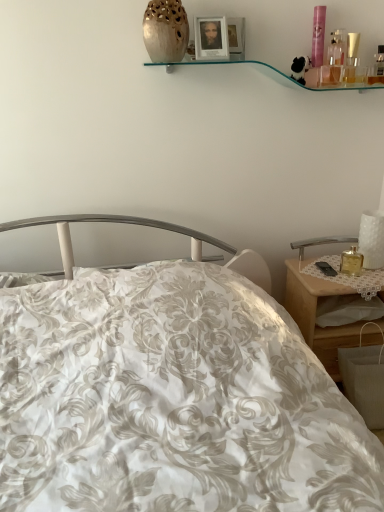
Question: From a real-world perspective, is matte wooden picture frame at upper center above or below wooden nightstand at right?

Choices:
 (A) below
 (B) above

Answer: (B)

Question: In terms of width, does matte wooden picture frame at upper center look wider or thinner when compared to wooden nightstand at right?

Choices:
 (A) wide
 (B) thin

Answer: (B)

Question: Which is farther from the matte wooden picture frame at upper center?

Choices:
 (A) matte beige vase at upper center
 (B) wooden nightstand at right

Answer: (B)

Question: Based on their relative distances, which object is farther from the wooden nightstand at right?

Choices:
 (A) matte wooden picture frame at upper center
 (B) matte beige vase at upper center

Answer: (B)